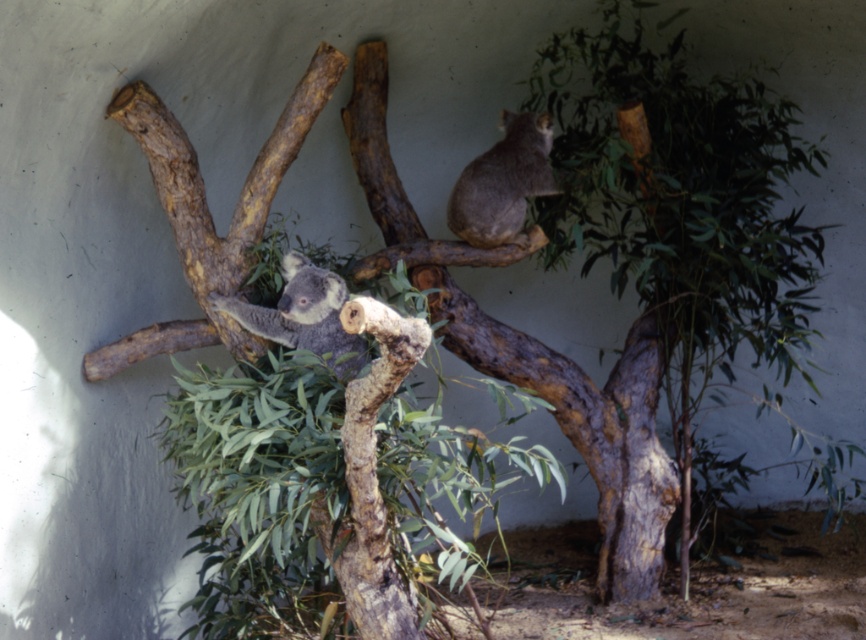
You are a zookeeper who needs to place a feeding tray between the gray furry koala at upper right and the gray furry koala at center. The feeding tray requires a minimum of 3 feet of space to be placed safely. Based on the scene, can you determine if there is enough space between them?

The gray furry koala at upper right and gray furry koala at center are 34.13 inches apart from each other. Since 34.13 inches is approximately 2.84 feet, which is less than the required 3 feet, there is not enough space to place the feeding tray safely between them.